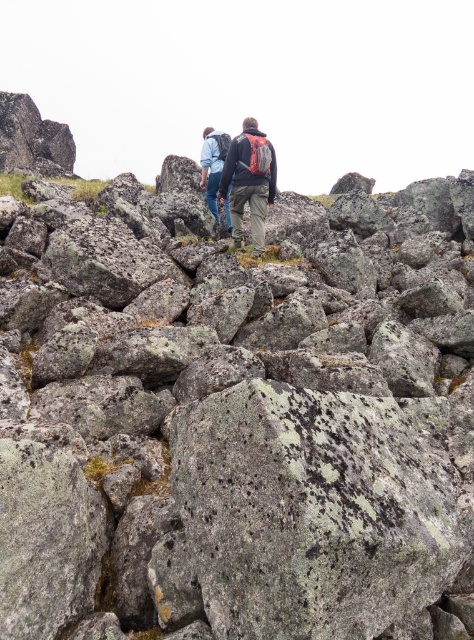
Is point (129, 209) positioned after point (275, 166)?

No, it is not.

Who is lower down, gray rough rock at center or matte black jacket at center?

gray rough rock at center is lower down.

This screenshot has width=474, height=640. Describe the element at coordinates (237, 417) in the screenshot. I see `gray rough rock at center` at that location.

You are a GUI agent. You are given a task and a screenshot of the screen. Output one action in this format:
    pyautogui.click(x=<x>, y=<y>)
    Task: Click on the gray rough rock at center
    Image resolution: width=474 pixels, height=640 pixels.
    Given the screenshot: What is the action you would take?
    pyautogui.click(x=237, y=417)

Is point (234, 145) behind point (213, 209)?

No, it is not.

Is matte black jacket at center to the right of blue denim jacket at center from the viewer's perspective?

Yes, matte black jacket at center is to the right of blue denim jacket at center.

Who is more forward, (254, 212) or (207, 168)?

Point (254, 212)

I want to click on matte black jacket at center, so click(x=248, y=182).

Which is below, gray rough rock at center or blue denim jacket at center?

gray rough rock at center

You are a GUI agent. You are given a task and a screenshot of the screen. Output one action in this format:
    pyautogui.click(x=<x>, y=<y>)
    Task: Click on the gray rough rock at center
    Image resolution: width=474 pixels, height=640 pixels.
    Given the screenshot: What is the action you would take?
    click(237, 417)

The height and width of the screenshot is (640, 474). Identify the location of gray rough rock at center. (237, 417).